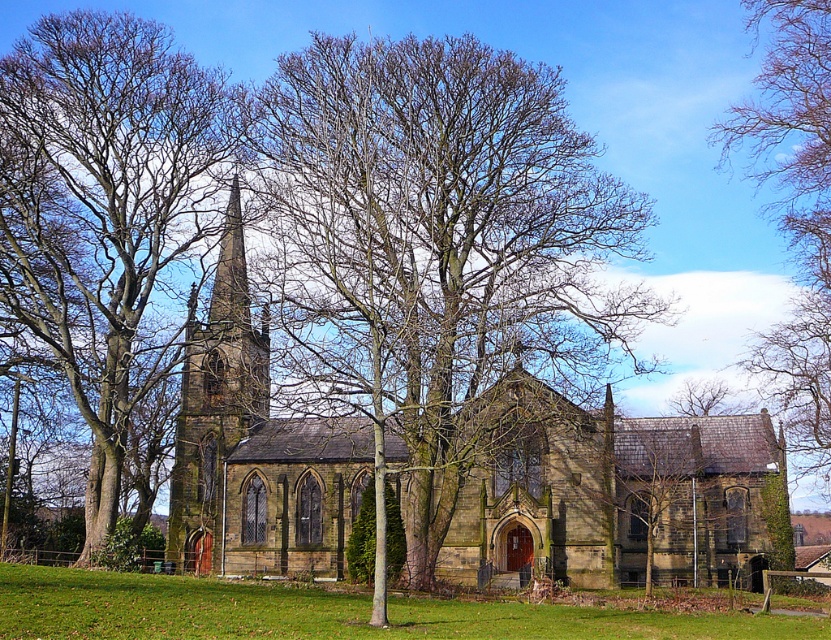
Between bare branches at upper right and brown stone tower at center, which one appears on the right side from the viewer's perspective?

Positioned to the right is bare branches at upper right.

The height and width of the screenshot is (640, 831). What are the coordinates of `bare branches at upper right` in the screenshot? It's located at (794, 212).

Is point (824, 150) farther from camera compared to point (187, 465)?

No, it is in front of (187, 465).

Find the location of `bare branches at upper right`. bare branches at upper right is located at coordinates (794, 212).

Measure the distance from bare branches at center to bare branches at upper right.

A distance of 37.97 meters exists between bare branches at center and bare branches at upper right.

Which is behind, point (308, 145) or point (807, 173)?

Positioned behind is point (807, 173).

Does point (372, 99) come in front of point (805, 60)?

Yes, point (372, 99) is closer to viewer.

Find the location of a particular element. bare branches at center is located at coordinates (433, 248).

Can you confirm if brown bark tree at left is positioned below brown stone tower at center?

Actually, brown bark tree at left is above brown stone tower at center.

Which is above, brown bark tree at left or brown stone tower at center?

brown bark tree at left is higher up.

Between point (217, 209) and point (247, 387), which one is positioned behind?

Positioned behind is point (247, 387).

Identify the location of brown bark tree at left. (106, 209).